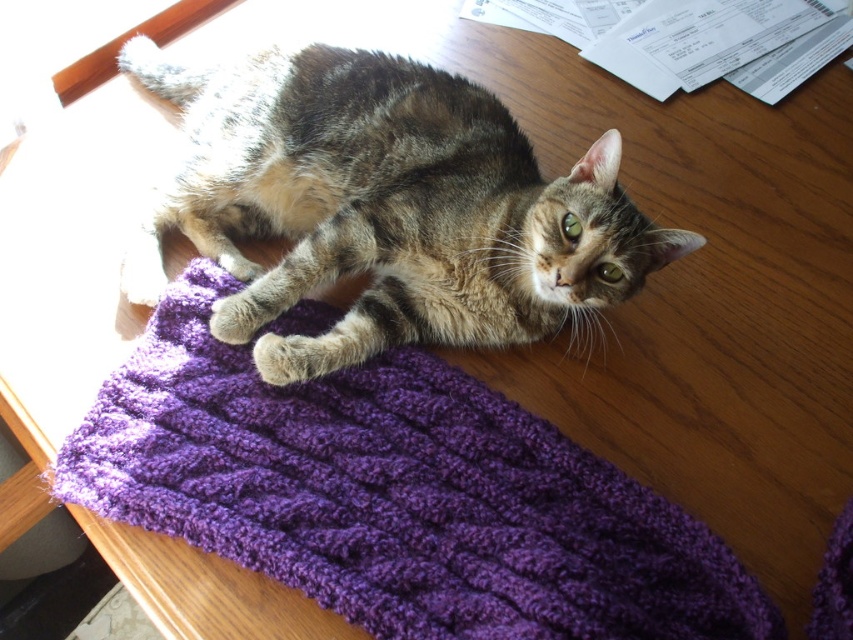
Question: Can you confirm if purple knitted mat at upper center is bigger than tabby fur cat at center?

Choices:
 (A) no
 (B) yes

Answer: (A)

Question: Can you confirm if purple knitted mat at upper center is thinner than tabby fur cat at center?

Choices:
 (A) no
 (B) yes

Answer: (A)

Question: Which point is farther to the camera?

Choices:
 (A) purple knitted mat at upper center
 (B) tabby fur cat at center

Answer: (B)

Question: Is purple knitted mat at upper center further to the viewer compared to tabby fur cat at center?

Choices:
 (A) no
 (B) yes

Answer: (A)